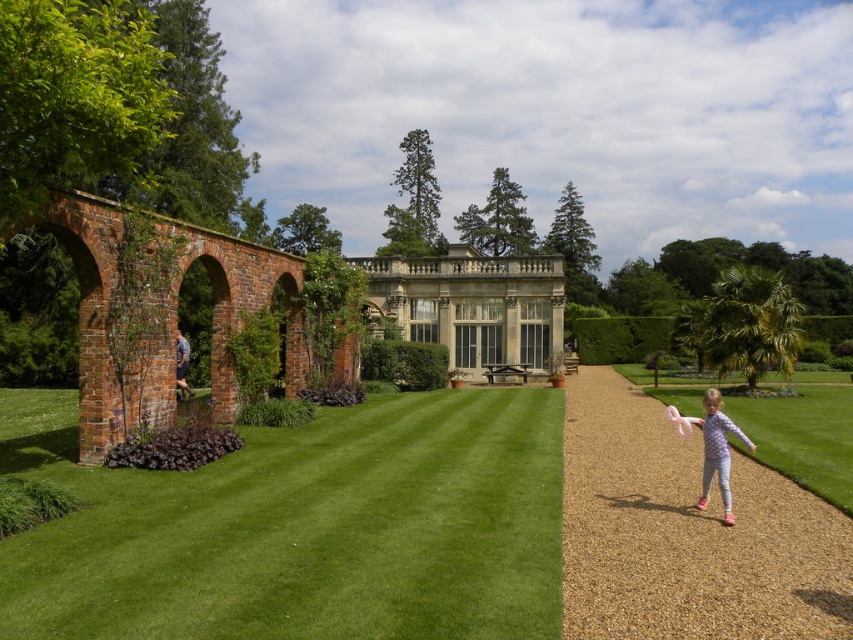
You are standing in the garden and want to reach the building in the background. The point marked at coordinates (274, 540) is part of the gravel pathway leading to the building. If you walk directly towards the building, will you pass through this point?

Yes, because the point marked at coordinates (274, 540) is 22.13 meters away from the camera, indicating it lies along the path towards the building.

Looking at this image, you are standing in the garden and want to walk from the green grass at center to the purple printed pajamas at right. Which direction should you move?

You should move to the right to reach the purple printed pajamas at right from the green grass at center since the green grass at center is located to the left of the purple printed pajamas at right.